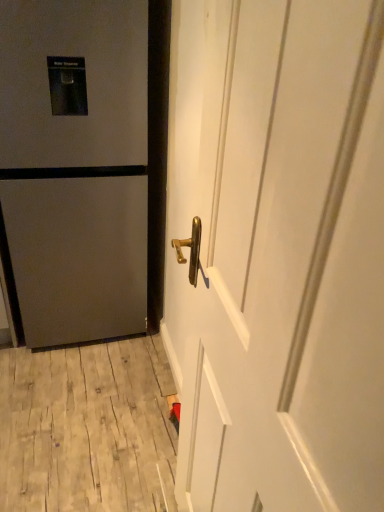
Question: Is the depth of matte gray refrigerator at left, the second door positioned from the front, greater than that of wooden at lower left?

Choices:
 (A) yes
 (B) no

Answer: (B)

Question: Considering the relative sizes of matte gray refrigerator at left, the first door viewed from the left, and wooden at lower left in the image provided, is matte gray refrigerator at left, the first door viewed from the left, wider than wooden at lower left?

Choices:
 (A) yes
 (B) no

Answer: (B)

Question: Is matte gray refrigerator at left, the second door positioned from the front, positioned with its back to wooden at lower left?

Choices:
 (A) no
 (B) yes

Answer: (A)

Question: Is the surface of matte gray refrigerator at left, the first door viewed from the left, in direct contact with wooden at lower left?

Choices:
 (A) no
 (B) yes

Answer: (A)

Question: Does matte gray refrigerator at left, the second door positioned from the front, have a greater height compared to wooden at lower left?

Choices:
 (A) yes
 (B) no

Answer: (A)

Question: Considering the positions of matte gray refrigerator at left, the second door positioned from the front, and wooden at lower left in the image, is matte gray refrigerator at left, the second door positioned from the front, taller or shorter than wooden at lower left?

Choices:
 (A) tall
 (B) short

Answer: (A)

Question: From a real-world perspective, is matte gray refrigerator at left, the second door positioned from the front, physically located above or below wooden at lower left?

Choices:
 (A) below
 (B) above

Answer: (B)

Question: Considering their positions, is matte gray refrigerator at left, the second door positioned from the front, located in front of or behind wooden at lower left?

Choices:
 (A) front
 (B) behind

Answer: (A)

Question: Considering the positions of point coord(29,294) and point coord(137,371), is point coord(29,294) closer or farther from the camera than point coord(137,371)?

Choices:
 (A) farther
 (B) closer

Answer: (B)

Question: Is white glossy door handle at center, which appears as the first door when viewed from the right, situated inside matte gray refrigerator at left, which is the 1th door in back-to-front order, or outside?

Choices:
 (A) outside
 (B) inside

Answer: (A)

Question: From a real-world perspective, is white glossy door handle at center, which is counted as the 2th door, starting from the left, above or below matte gray refrigerator at left, the 2th door from the right?

Choices:
 (A) below
 (B) above

Answer: (B)

Question: Considering the relative positions of white glossy door handle at center, placed as the 1th door when sorted from front to back, and matte gray refrigerator at left, the second door positioned from the front, in the image provided, is white glossy door handle at center, placed as the 1th door when sorted from front to back, to the left or to the right of matte gray refrigerator at left, the second door positioned from the front,?

Choices:
 (A) right
 (B) left

Answer: (A)

Question: Looking at their shapes, would you say white glossy door handle at center, placed as the 1th door when sorted from front to back, is wider or thinner than matte gray refrigerator at left, the 2th door from the right?

Choices:
 (A) thin
 (B) wide

Answer: (A)

Question: In the image, is wooden at lower left on the left side or the right side of matte gray refrigerator at left, which is the 1th door in back-to-front order?

Choices:
 (A) right
 (B) left

Answer: (A)

Question: In terms of width, does wooden at lower left look wider or thinner when compared to matte gray refrigerator at left, the first door viewed from the left?

Choices:
 (A) wide
 (B) thin

Answer: (A)